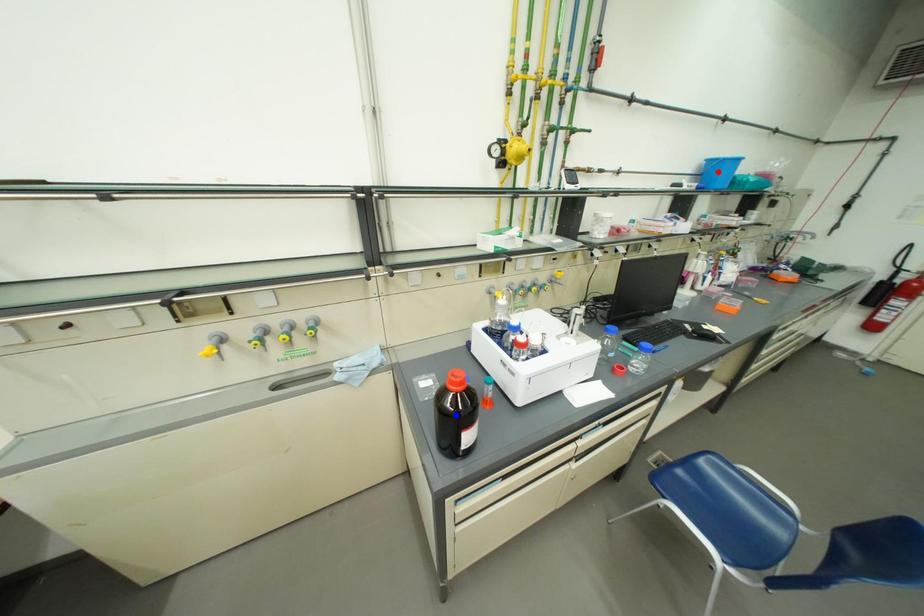
Question: Two points are marked on the image. Which point is closer to the camera?

Choices:
 (A) Blue point is closer.
 (B) Red point is closer.

Answer: (A)